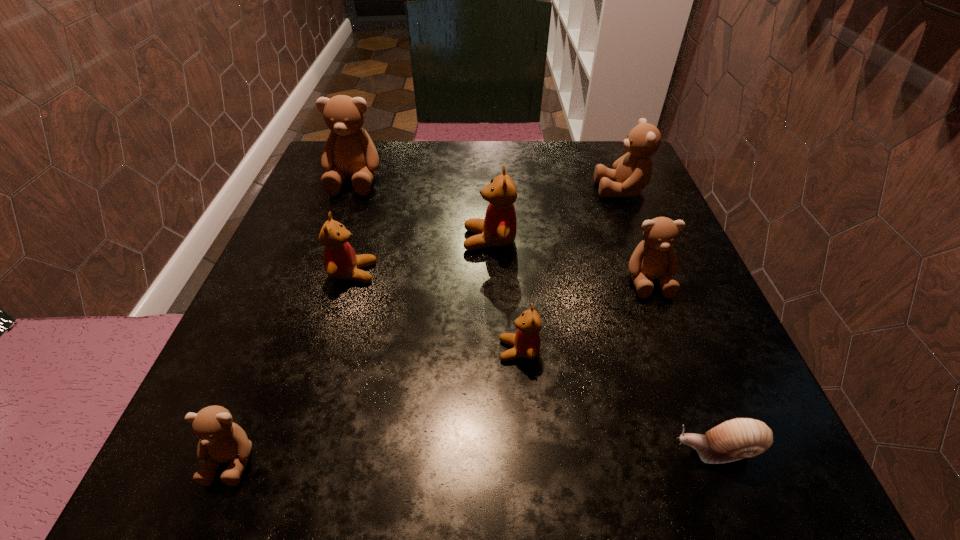
The height and width of the screenshot is (540, 960). Identify the location of object located in the near left corner section of the desktop. (221, 440).

I want to click on object that is at the far right corner, so click(x=632, y=172).

The width and height of the screenshot is (960, 540). What are the coordinates of `object that is at the near right corner` in the screenshot? It's located at (739, 438).

The height and width of the screenshot is (540, 960). I want to click on blank space at the far edge of the desktop, so click(x=553, y=166).

You are a GUI agent. You are given a task and a screenshot of the screen. Output one action in this format:
    pyautogui.click(x=<x>, y=<y>)
    Task: Click on the vacant area at the near edge
    The width and height of the screenshot is (960, 540).
    Given the screenshot: What is the action you would take?
    pyautogui.click(x=417, y=470)

This screenshot has width=960, height=540. In the image, there is a desktop. Identify the location of free region at the left edge. (306, 260).

You are a GUI agent. You are given a task and a screenshot of the screen. Output one action in this format:
    pyautogui.click(x=<x>, y=<y>)
    Task: Click on the free space at the right edge of the desktop
    
    Given the screenshot: What is the action you would take?
    pyautogui.click(x=597, y=239)

Identify the location of blank space at the far right corner. (606, 147).

Find the location of a particular element. This screenshot has height=540, width=960. vacant space that is in between the biggest brown teddy bear and the third smallest brown teddy bear is located at coordinates (488, 185).

This screenshot has height=540, width=960. Identify the location of free space between the nearest teddy bear and the sixth farthest object. (375, 405).